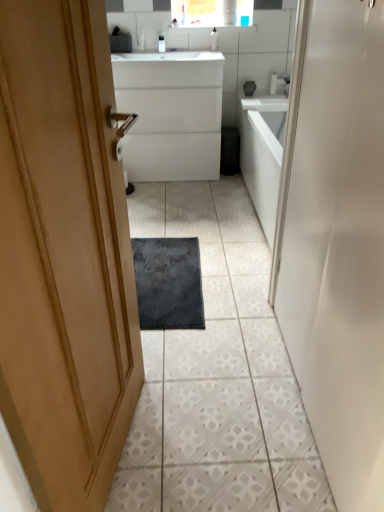
Question: Considering the relative sizes of white glossy door at center and white textured tile at center in the image provided, is white glossy door at center taller than white textured tile at center?

Choices:
 (A) no
 (B) yes

Answer: (B)

Question: Can you confirm if white glossy door at center is positioned to the left of white textured tile at center?

Choices:
 (A) no
 (B) yes

Answer: (A)

Question: From a real-world perspective, does white glossy door at center stand above white textured tile at center?

Choices:
 (A) yes
 (B) no

Answer: (A)

Question: Is white glossy door at center bigger than white textured tile at center?

Choices:
 (A) yes
 (B) no

Answer: (A)

Question: Could you tell me if white glossy door at center is turned towards white textured tile at center?

Choices:
 (A) no
 (B) yes

Answer: (A)

Question: Is there a large distance between white glossy door at center and white textured tile at center?

Choices:
 (A) yes
 (B) no

Answer: (B)

Question: Would you say dark gray textured bath mat at center is a long distance from white glossy door at center?

Choices:
 (A) yes
 (B) no

Answer: (B)

Question: Would you say white glossy door at center is part of dark gray textured bath mat at center's contents?

Choices:
 (A) no
 (B) yes

Answer: (A)

Question: Is dark gray textured bath mat at center taller than white glossy door at center?

Choices:
 (A) yes
 (B) no

Answer: (B)

Question: Considering the relative positions of dark gray textured bath mat at center and white glossy door at center in the image provided, is dark gray textured bath mat at center to the right of white glossy door at center from the viewer's perspective?

Choices:
 (A) yes
 (B) no

Answer: (B)

Question: Can you confirm if dark gray textured bath mat at center is shorter than white glossy door at center?

Choices:
 (A) yes
 (B) no

Answer: (A)

Question: From the image's perspective, is dark gray textured bath mat at center located beneath white glossy door at center?

Choices:
 (A) no
 (B) yes

Answer: (B)

Question: Does white glossy soap dispenser at upper center, placed as the 1th toiletry when sorted from right to left, come behind matte white faucet at upper center?

Choices:
 (A) no
 (B) yes

Answer: (A)